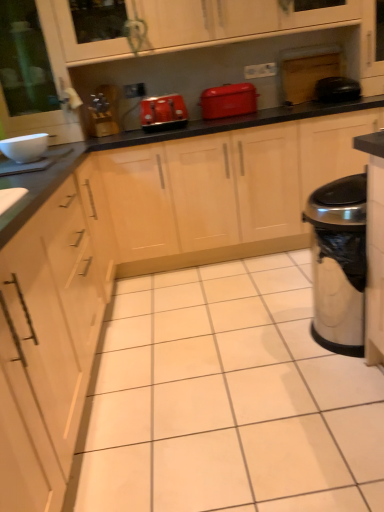
What do you see at coordinates (337, 90) in the screenshot? The height and width of the screenshot is (512, 384). I see `black rubber trash can at right, placed as the second appliance when sorted from bottom to top` at bounding box center [337, 90].

What are the coordinates of `white glossy bowl at upper left, which ranks as the second appliance in top-to-bottom order` in the screenshot? It's located at point(25,147).

The height and width of the screenshot is (512, 384). Identify the location of black glossy countertop at center. (147, 143).

What do you see at coordinates (339, 263) in the screenshot? I see `silver metallic trash can at right` at bounding box center [339, 263].

Image resolution: width=384 pixels, height=512 pixels. Describe the element at coordinates (198, 25) in the screenshot. I see `matte wood cabinet at upper center` at that location.

What is the approximate width of matte plastic toaster at center?

It is 12.71 inches.

In order to click on black rubber trash can at right, the first appliance viewed from the top in this screenshot , I will do `click(337, 90)`.

Is matte wood cabinet at upper center taller than matte red toaster at center?

Yes, matte wood cabinet at upper center is taller than matte red toaster at center.

Consider the image. From the image's perspective, which one is positioned higher, matte wood cabinet at upper center or matte red toaster at center?

From the image's view, matte wood cabinet at upper center is above.

Does matte wood cabinet at upper center contain matte red toaster at center?

That's incorrect, matte red toaster at center is not inside matte wood cabinet at upper center.

Does matte red toaster at center contain black glossy countertop at center?

No, black glossy countertop at center is not a part of matte red toaster at center.

The width and height of the screenshot is (384, 512). I want to click on home appliance behind the black glossy countertop at center, so click(x=228, y=101).

Measure the distance from matte red toaster at center to black glossy countertop at center.

matte red toaster at center and black glossy countertop at center are 13.78 inches apart from each other.

Between point (228, 88) and point (186, 136), which one is positioned in front?

The point (186, 136) is closer.

Visually, is matte red toaster at center positioned to the left or to the right of silver metallic trash can at right?

Based on their positions, matte red toaster at center is located to the left of silver metallic trash can at right.

Locate an element on the screen. This screenshot has height=512, width=384. home appliance behind the silver metallic trash can at right is located at coordinates (228, 101).

Which is in front, point (207, 102) or point (323, 284)?

Point (323, 284)

Between matte red toaster at center and silver metallic trash can at right, which one has larger width?

Wider between the two is silver metallic trash can at right.

Can you confirm if silver metallic trash can at right is bigger than black glossy countertop at center?

Actually, silver metallic trash can at right might be smaller than black glossy countertop at center.

How distant is silver metallic trash can at right from black glossy countertop at center?

silver metallic trash can at right and black glossy countertop at center are 3.64 feet apart.

Considering the relative positions of silver metallic trash can at right and black glossy countertop at center in the image provided, is silver metallic trash can at right to the left of black glossy countertop at center from the viewer's perspective?

Incorrect, silver metallic trash can at right is not on the left side of black glossy countertop at center.

Is silver metallic trash can at right oriented away from black glossy countertop at center?

silver metallic trash can at right does not have its back to black glossy countertop at center.

Is matte wood cabinet at upper center next to black rubber trash can at right, which appears as the first appliance when viewed from the back, and touching it?

No, matte wood cabinet at upper center is not touching black rubber trash can at right, which appears as the first appliance when viewed from the back.

Considering the relative sizes of matte wood cabinet at upper center and black rubber trash can at right, the first appliance viewed from the right, in the image provided, is matte wood cabinet at upper center bigger than black rubber trash can at right, the first appliance viewed from the right,?

Yes.

Is matte wood cabinet at upper center wider or thinner than black rubber trash can at right, placed as the second appliance when sorted from bottom to top?

matte wood cabinet at upper center is wider than black rubber trash can at right, placed as the second appliance when sorted from bottom to top.

Considering the positions of objects matte wood cabinet at upper center and black rubber trash can at right, the first appliance viewed from the right, in the image provided, who is in front, matte wood cabinet at upper center or black rubber trash can at right, the first appliance viewed from the right,?

matte wood cabinet at upper center is closer to the camera.

Is black rubber trash can at right, which appears as the first appliance when viewed from the back, further to camera compared to matte wood cabinet at upper center?

Yes, black rubber trash can at right, which appears as the first appliance when viewed from the back, is further from the viewer.

From the image's perspective, is black rubber trash can at right, the first appliance viewed from the right, located above or below matte wood cabinet at upper center?

From the image's perspective, black rubber trash can at right, the first appliance viewed from the right, appears below matte wood cabinet at upper center.

Is black rubber trash can at right, the first appliance viewed from the right, completely or partially outside of matte wood cabinet at upper center?

Yes, black rubber trash can at right, the first appliance viewed from the right, is not within matte wood cabinet at upper center.

Is black rubber trash can at right, positioned as the 2th appliance in left-to-right order, shorter than matte wood cabinet at upper center?

Yes.

Consider the image. Considering the positions of objects black glossy countertop at center and black rubber trash can at right, the first appliance viewed from the top, in the image provided, who is in front, black glossy countertop at center or black rubber trash can at right, the first appliance viewed from the top,?

black glossy countertop at center is closer to the camera.

Between black glossy countertop at center and black rubber trash can at right, placed as the second appliance when sorted from bottom to top, which one has more height?

black glossy countertop at center.

Is black glossy countertop at center thinner than black rubber trash can at right, which appears as the first appliance when viewed from the back?

Incorrect, the width of black glossy countertop at center is not less than that of black rubber trash can at right, which appears as the first appliance when viewed from the back.

Is black glossy countertop at center not close to black rubber trash can at right, placed as the second appliance when sorted from bottom to top?

No, there isn't a large distance between black glossy countertop at center and black rubber trash can at right, placed as the second appliance when sorted from bottom to top.

Locate an element on the screen. cabinetry located above the matte red toaster at center (from the image's perspective) is located at coordinates (198, 25).

At what (x,y) coordinates should I click in order to perform the action: click on countertop below the matte red toaster at center (from a real-world perspective). Please return your answer as a coordinate pair (x, y). Image resolution: width=384 pixels, height=512 pixels. Looking at the image, I should click on (147, 143).

From the picture: When comparing their distances from black rubber trash can at right, positioned as the 2th appliance in left-to-right order, does matte red toaster at center or silver metallic trash can at right seem closer?

Among the two, matte red toaster at center is located nearer to black rubber trash can at right, positioned as the 2th appliance in left-to-right order.

Considering their positions, is silver metallic trash can at right positioned further to matte red toaster at center than matte wood cabinet at upper center?

silver metallic trash can at right.

Considering their positions, is black glossy countertop at center positioned closer to silver metallic trash can at right than black rubber trash can at right, the 2th appliance positioned from the front?

black glossy countertop at center is positioned closer to the anchor silver metallic trash can at right.

Estimate the real-world distances between objects in this image. Which object is further from black glossy countertop at center, matte plastic toaster at center or black rubber trash can at right, which appears as the first appliance when viewed from the back?

black rubber trash can at right, which appears as the first appliance when viewed from the back, lies further to black glossy countertop at center than the other object.

When comparing their distances from black rubber trash can at right, placed as the second appliance when sorted from bottom to top, does matte plastic toaster at center or matte wood cabinet at upper center seem further?

matte plastic toaster at center.

Based on their spatial positions, is matte red toaster at center or black glossy countertop at center closer to black rubber trash can at right, placed as the second appliance when sorted from bottom to top?

Among the two, black glossy countertop at center is located nearer to black rubber trash can at right, placed as the second appliance when sorted from bottom to top.

When comparing their distances from black rubber trash can at right, positioned as the 2th appliance in left-to-right order, does matte red toaster at center or matte wood cabinet at upper center seem closer?

matte red toaster at center lies closer to black rubber trash can at right, positioned as the 2th appliance in left-to-right order, than the other object.

Estimate the real-world distances between objects in this image. Which object is closer to matte red toaster at center, matte wood cabinet at upper center or black glossy countertop at center?

Based on the image, black glossy countertop at center appears to be nearer to matte red toaster at center.

You are a GUI agent. You are given a task and a screenshot of the screen. Output one action in this format:
    pyautogui.click(x=<x>, y=<y>)
    Task: Click on the home appliance between matte wood cabinet at upper center and black glossy countertop at center in the up-down direction
    This screenshot has width=384, height=512.
    Given the screenshot: What is the action you would take?
    pyautogui.click(x=228, y=101)

Find the location of a particular element. This screenshot has width=384, height=512. home appliance between white glossy bowl at upper left, the first appliance in the bottom-to-top sequence, and silver metallic trash can at right, in the horizontal direction is located at coordinates (228, 101).

The image size is (384, 512). Identify the location of kitchen appliance between white glossy bowl at upper left, positioned as the 1th appliance in front-to-back order, and black rubber trash can at right, which appears as the first appliance when viewed from the back. (163, 113).

What are the coordinates of `cabinetry between white glossy bowl at upper left, positioned as the 1th appliance in front-to-back order, and black rubber trash can at right, the first appliance viewed from the top, in the horizontal direction` in the screenshot? It's located at (198, 25).